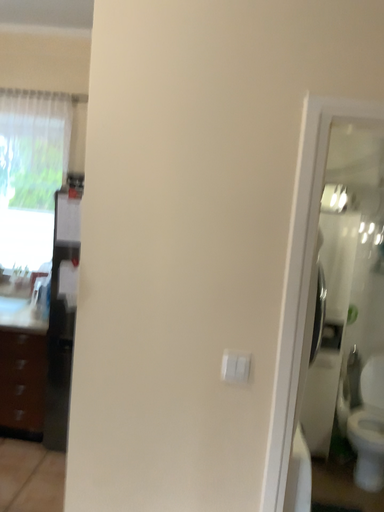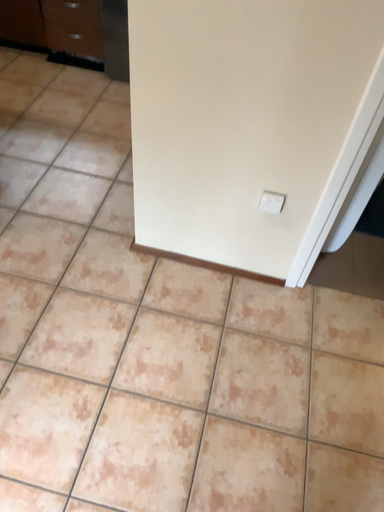
Question: Which way did the camera rotate in the video?

Choices:
 (A) rotated right
 (B) rotated left

Answer: (B)